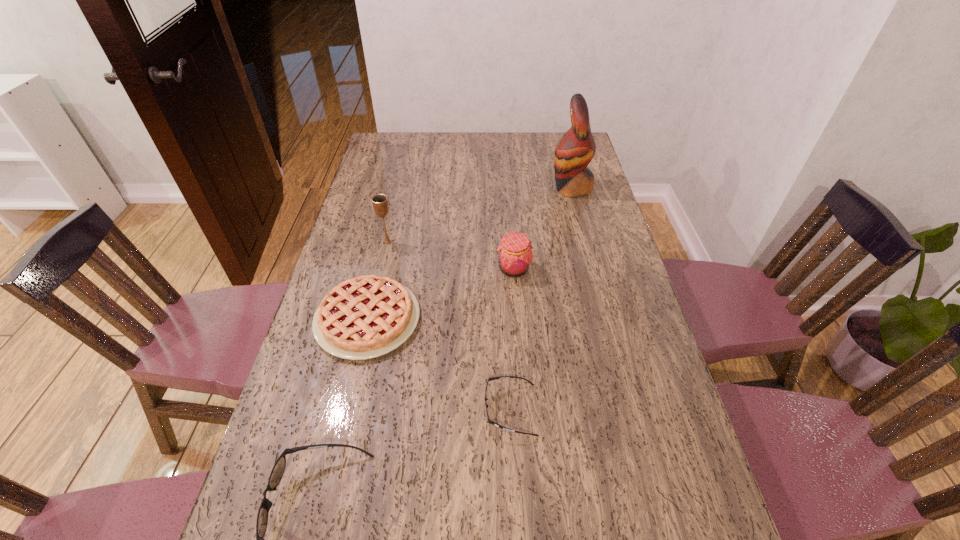
The width and height of the screenshot is (960, 540). Find the location of `object that is the fourth closest to the parrot`. object that is the fourth closest to the parrot is located at coordinates (488, 420).

Image resolution: width=960 pixels, height=540 pixels. Identify the location of object that can be found as the fourth closest to the right sunglasses. (380, 203).

Locate an element on the screen. This screenshot has width=960, height=540. vacant space that satisfies the following two spatial constraints: 1. on the front side of the fourth nearest object; 2. on the left side of the fifth nearest object is located at coordinates (381, 269).